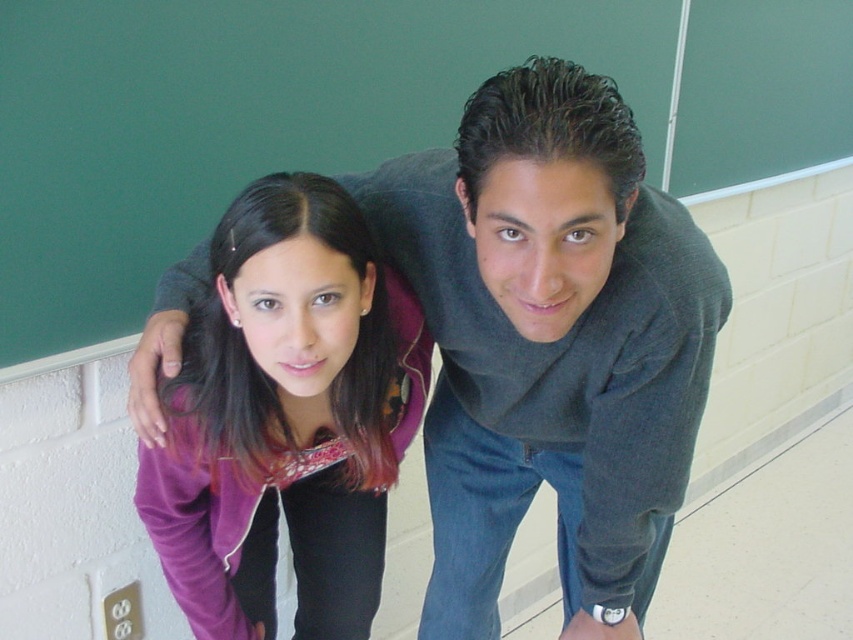
Can you confirm if green chalkboard at upper center is smaller than purple fleece jacket at center?

Actually, green chalkboard at upper center might be larger than purple fleece jacket at center.

Between point (189, 179) and point (375, 266), which one is positioned behind?

The point (189, 179) is more distant.

At what (x,y) coordinates should I click in order to perform the action: click on green chalkboard at upper center. Please return your answer as a coordinate pair (x, y). This screenshot has height=640, width=853. Looking at the image, I should click on (344, 115).

Does green chalkboard at upper center appear over matte gray sweater at center?

Yes, green chalkboard at upper center is above matte gray sweater at center.

Who is more forward, (196, 195) or (598, 461)?

Point (598, 461)

This screenshot has height=640, width=853. Describe the element at coordinates (344, 115) in the screenshot. I see `green chalkboard at upper center` at that location.

Where is `green chalkboard at upper center`? green chalkboard at upper center is located at coordinates (344, 115).

Does point (488, 548) lie in front of point (323, 262)?

No, (488, 548) is further to viewer.

At what (x,y) coordinates should I click in order to perform the action: click on matte gray sweater at center. Please return your answer as a coordinate pair (x, y). The height and width of the screenshot is (640, 853). Looking at the image, I should click on coord(550,342).

Who is more forward, (431, 291) or (375, 531)?

Point (431, 291) is in front.

Find the location of `matte gray sweater at center`. matte gray sweater at center is located at coordinates (550, 342).